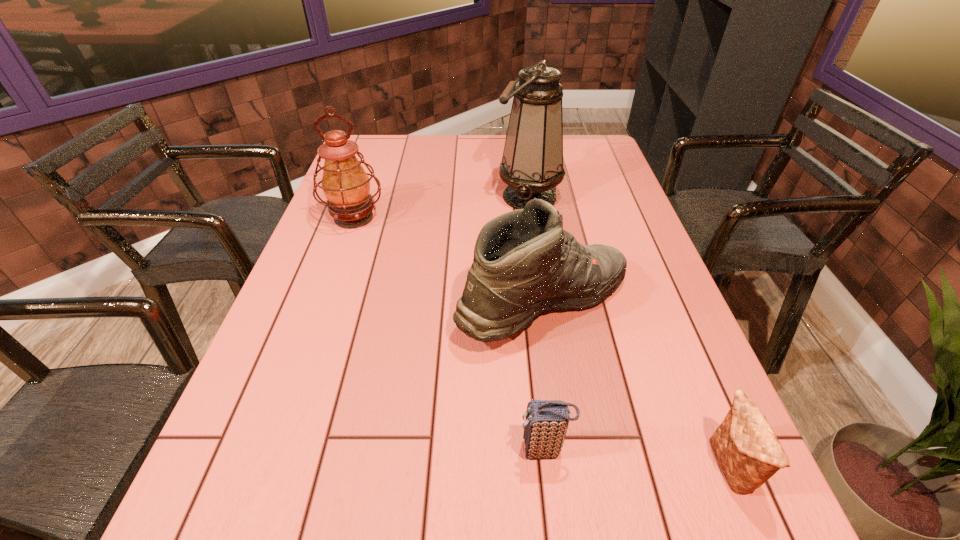
You are a GUI agent. You are given a task and a screenshot of the screen. Output one action in this format:
    pyautogui.click(x=<x>, y=<y>)
    Task: Click on the right oil lamp
    The image size is (960, 540).
    Given the screenshot: What is the action you would take?
    pyautogui.click(x=532, y=163)

The image size is (960, 540). What are the coordinates of `the taller oil lamp` in the screenshot? It's located at (532, 163).

Where is `the shorter oil lamp`? The height and width of the screenshot is (540, 960). the shorter oil lamp is located at coordinates (345, 184).

Identify the location of the left oil lamp. (x=345, y=184).

At what (x,y) coordinates should I click in order to perform the action: click on the third nearest object. Please return your answer as a coordinate pair (x, y). This screenshot has height=540, width=960. Looking at the image, I should click on point(524,262).

Find the location of a particular element. This screenshot has width=960, height=540. the third shortest object is located at coordinates (524, 262).

Locate an element on the screen. the left clutch bag is located at coordinates (546, 423).

At what (x,y) coordinates should I click in order to perform the action: click on the right clutch bag. Please return your answer as a coordinate pair (x, y). The width and height of the screenshot is (960, 540). Looking at the image, I should click on (747, 450).

Identify the location of vacant space located on the right of the taller oil lamp. This screenshot has width=960, height=540. (596, 197).

You are a GUI agent. You are given a task and a screenshot of the screen. Output one action in this format:
    pyautogui.click(x=<x>, y=<y>)
    Task: Click on the free location located 0.390m on the right of the left oil lamp
    This screenshot has width=960, height=540.
    Given the screenshot: What is the action you would take?
    pyautogui.click(x=518, y=218)